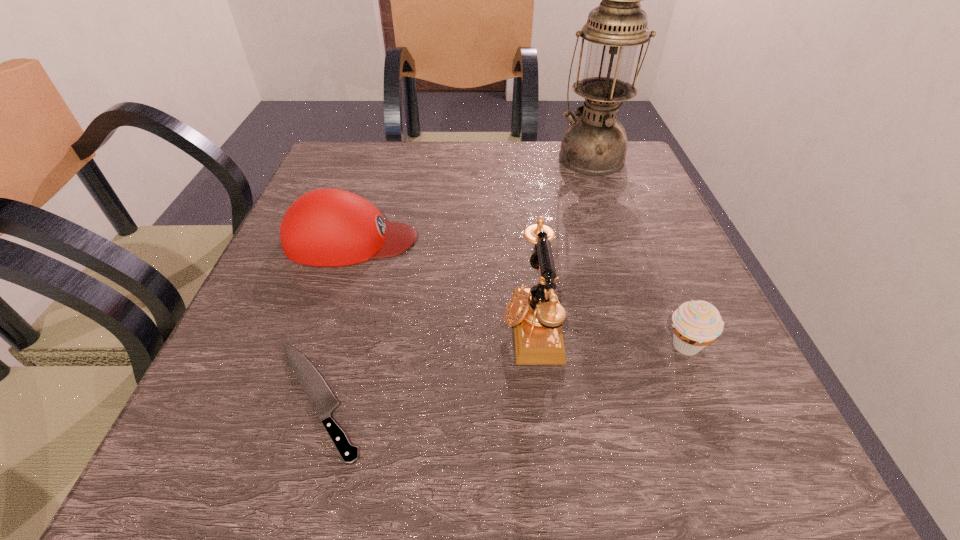
Locate an element on the screen. vacant position in the image that satisfies the following two spatial constraints: 1. on the front-facing side of the muffin; 2. on the right side of the baseball cap is located at coordinates (317, 346).

Where is `vacant region that satisfies the following two spatial constraints: 1. on the back side of the muffin; 2. on the right side of the steak knife`? vacant region that satisfies the following two spatial constraints: 1. on the back side of the muffin; 2. on the right side of the steak knife is located at coordinates (333, 346).

Where is `free region that satisfies the following two spatial constraints: 1. on the dial of the fourth shortest object; 2. on the back side of the muffin`? free region that satisfies the following two spatial constraints: 1. on the dial of the fourth shortest object; 2. on the back side of the muffin is located at coordinates pyautogui.click(x=534, y=346).

The width and height of the screenshot is (960, 540). Find the location of `vacant region that satisfies the following two spatial constraints: 1. on the back side of the steak knife; 2. on the front-facing side of the baseball cap`. vacant region that satisfies the following two spatial constraints: 1. on the back side of the steak knife; 2. on the front-facing side of the baseball cap is located at coordinates (364, 240).

The height and width of the screenshot is (540, 960). In order to click on free space that satisfies the following two spatial constraints: 1. on the dial of the muffin; 2. on the left side of the telephone in this screenshot , I will do `click(534, 346)`.

Locate an element on the screen. free space that satisfies the following two spatial constraints: 1. on the front-facing side of the fourth nearest object; 2. on the back side of the steak knife is located at coordinates (300, 399).

Where is `vacant space that satisfies the following two spatial constraints: 1. on the front side of the farthest object; 2. on the dial of the telephone`? This screenshot has height=540, width=960. vacant space that satisfies the following two spatial constraints: 1. on the front side of the farthest object; 2. on the dial of the telephone is located at coordinates (651, 326).